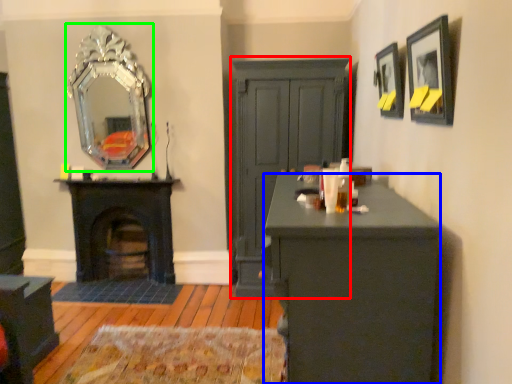
Question: Considering the real-world distances, which object is farthest from dresser (highlighted by a red box)? desk (highlighted by a blue box) or mirror (highlighted by a green box)?

Choices:
 (A) desk
 (B) mirror

Answer: (A)